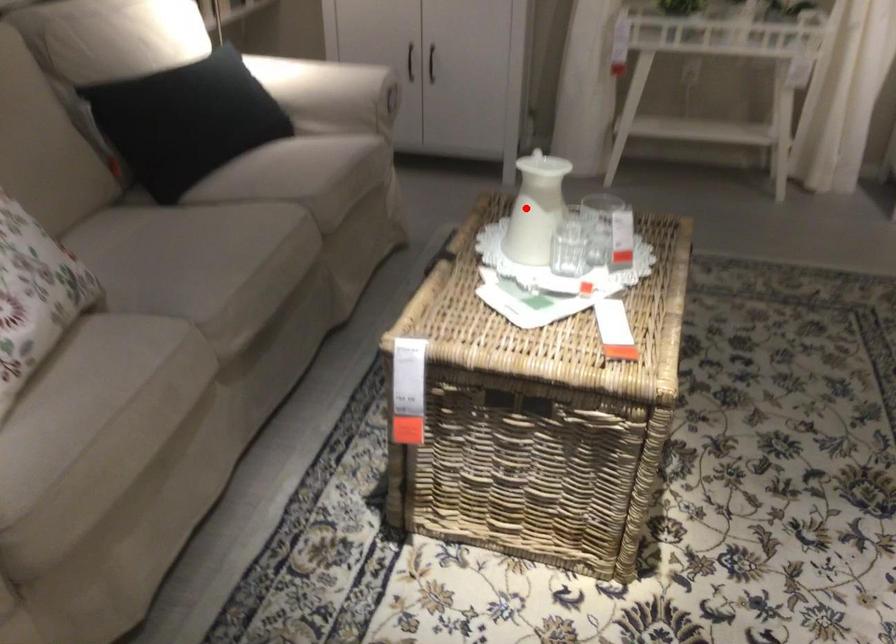
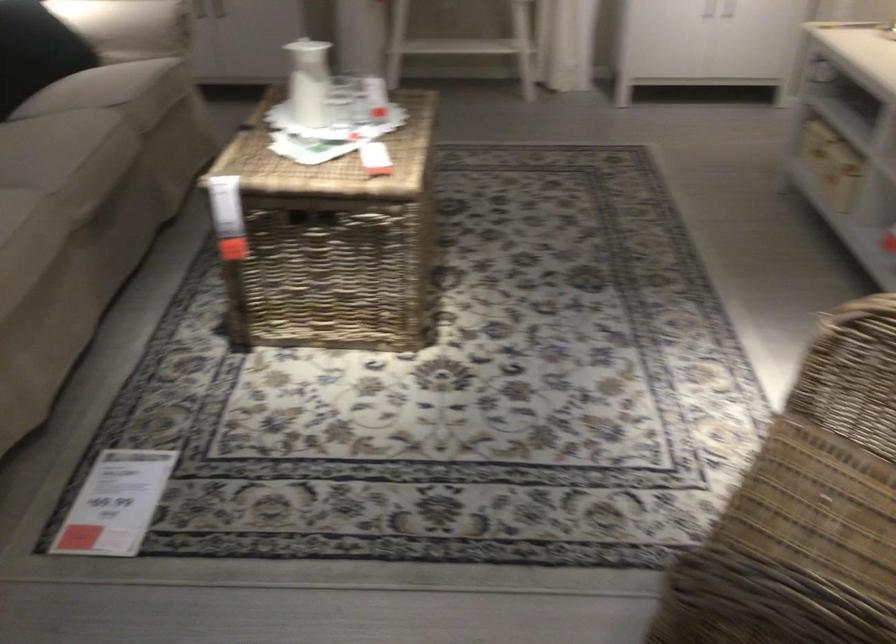
Locate, in the second image, the point that corresponds to the highlighted location in the first image.

(308, 82)